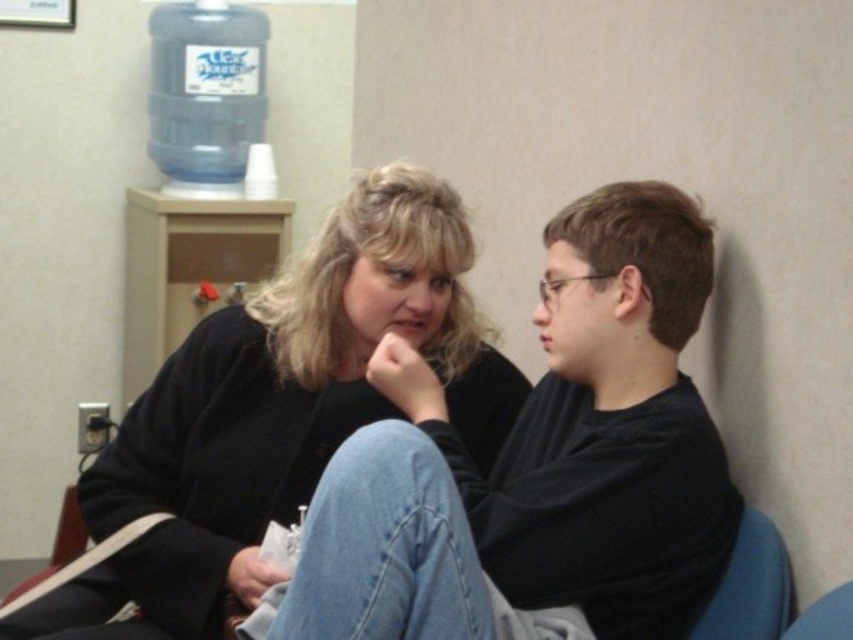
Question: Based on their relative distances, which object is nearer to the black matte shirt at center?

Choices:
 (A) matte black sweater at center
 (B) blue plastic water cooler at upper left

Answer: (A)

Question: Which object is farther from the camera taking this photo?

Choices:
 (A) blue plastic water cooler at upper left
 (B) black matte shirt at center

Answer: (A)

Question: Considering the real-world distances, which object is closest to the matte black sweater at center?

Choices:
 (A) blue plastic water cooler at upper left
 (B) black matte shirt at center

Answer: (B)

Question: Is black matte shirt at center bigger than matte black sweater at center?

Choices:
 (A) no
 (B) yes

Answer: (B)

Question: Is black matte shirt at center in front of matte black sweater at center?

Choices:
 (A) yes
 (B) no

Answer: (A)

Question: Does black matte shirt at center appear over blue plastic water cooler at upper left?

Choices:
 (A) yes
 (B) no

Answer: (B)